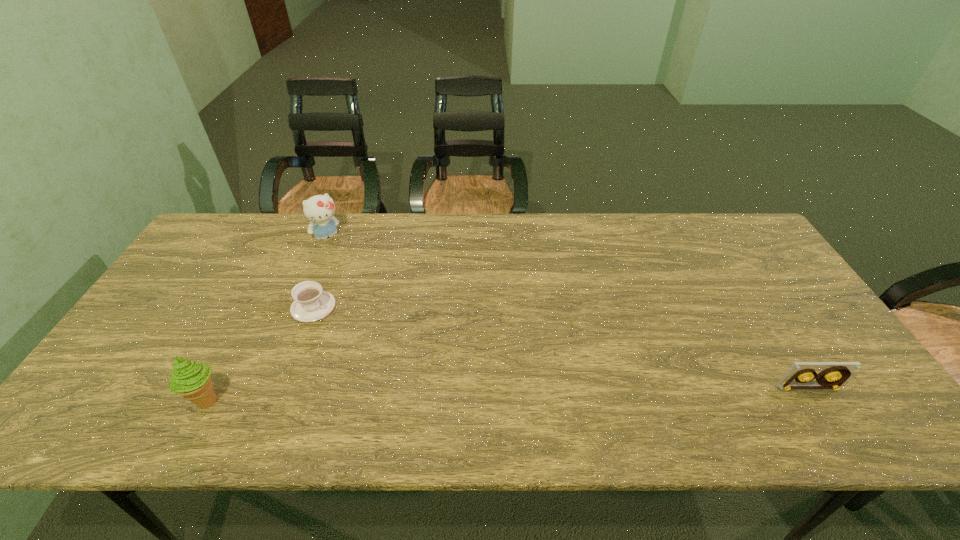
I want to click on vacant space on the desktop that is between the icecream and the videotape and is positioned on the handle side of the teacup, so click(x=462, y=395).

Image resolution: width=960 pixels, height=540 pixels. I want to click on free space on the desktop that is between the leftmost object and the third tallest object and is positioned on the front-facing side of the kitten, so click(440, 396).